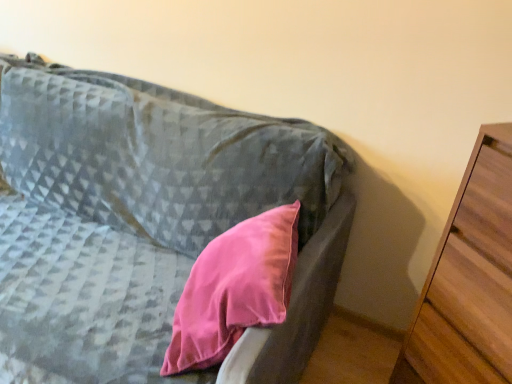
Locate an element on the screen. The height and width of the screenshot is (384, 512). wooden chest of drawers at right is located at coordinates (469, 280).

Describe the element at coordinates (469, 280) in the screenshot. This screenshot has height=384, width=512. I see `wooden chest of drawers at right` at that location.

Identify the location of matte gray couch at center. (145, 217).

The height and width of the screenshot is (384, 512). Describe the element at coordinates (145, 217) in the screenshot. I see `matte gray couch at center` at that location.

The width and height of the screenshot is (512, 384). I want to click on wooden chest of drawers at right, so click(x=469, y=280).

Can you confirm if matte gray couch at center is positioned to the right of wooden chest of drawers at right?

No, matte gray couch at center is not to the right of wooden chest of drawers at right.

Is the position of matte gray couch at center more distant than that of wooden chest of drawers at right?

No, it is not.

Which is behind, point (126, 350) or point (452, 233)?

The point (126, 350) is farther.

From the image's perspective, is matte gray couch at center above or below wooden chest of drawers at right?

matte gray couch at center is above wooden chest of drawers at right.

From a real-world perspective, who is located higher, matte gray couch at center or wooden chest of drawers at right?

From a 3D spatial view, wooden chest of drawers at right is above.

Looking at their sizes, would you say matte gray couch at center is wider or thinner than wooden chest of drawers at right?

matte gray couch at center is wider than wooden chest of drawers at right.

Can you confirm if matte gray couch at center is shorter than wooden chest of drawers at right?

Correct, matte gray couch at center is not as tall as wooden chest of drawers at right.

Who is smaller, matte gray couch at center or wooden chest of drawers at right?

wooden chest of drawers at right.

Is matte gray couch at center spatially inside wooden chest of drawers at right, or outside of it?

matte gray couch at center is not inside wooden chest of drawers at right, it's outside.

Consider the image. Is matte gray couch at center directly adjacent to wooden chest of drawers at right?

No, matte gray couch at center is not with wooden chest of drawers at right.

Could you tell me if matte gray couch at center is facing wooden chest of drawers at right?

No, matte gray couch at center is not turned towards wooden chest of drawers at right.

How different are the orientations of matte gray couch at center and wooden chest of drawers at right in degrees?

The angle between the facing direction of matte gray couch at center and the facing direction of wooden chest of drawers at right is 42.8 degrees.

How much distance is there between matte gray couch at center and wooden chest of drawers at right?

matte gray couch at center is 70.37 centimeters from wooden chest of drawers at right.

This screenshot has height=384, width=512. I want to click on chest of drawers on the right side of matte gray couch at center, so click(469, 280).

Is wooden chest of drawers at right to the left of matte gray couch at center from the viewer's perspective?

In fact, wooden chest of drawers at right is to the right of matte gray couch at center.

Is wooden chest of drawers at right further to camera compared to matte gray couch at center?

Yes, wooden chest of drawers at right is further from the camera.

Is point (471, 303) farther from camera compared to point (317, 226)?

No, it is in front of (317, 226).

In the scene shown: From the image's perspective, is wooden chest of drawers at right on matte gray couch at center?

Incorrect, from the image's perspective, wooden chest of drawers at right is lower than matte gray couch at center.

From a real-world perspective, is wooden chest of drawers at right on top of matte gray couch at center?

Yes, from a real-world perspective, wooden chest of drawers at right is on top of matte gray couch at center.

Can you confirm if wooden chest of drawers at right is thinner than matte gray couch at center?

Correct, the width of wooden chest of drawers at right is less than that of matte gray couch at center.

Between wooden chest of drawers at right and matte gray couch at center, which one has less height?

matte gray couch at center.

Considering the relative sizes of wooden chest of drawers at right and matte gray couch at center in the image provided, is wooden chest of drawers at right bigger than matte gray couch at center?

Actually, wooden chest of drawers at right might be smaller than matte gray couch at center.

Does wooden chest of drawers at right contain matte gray couch at center?

No, matte gray couch at center is not inside wooden chest of drawers at right.

In the scene shown: Is wooden chest of drawers at right far away from matte gray couch at center?

No, wooden chest of drawers at right is in close proximity to matte gray couch at center.

Is wooden chest of drawers at right looking in the opposite direction of matte gray couch at center?

No, matte gray couch at center is not at the back of wooden chest of drawers at right.

What's the angular difference between wooden chest of drawers at right and matte gray couch at center's facing directions?

They differ by 42.8 degrees in their facing directions.

The height and width of the screenshot is (384, 512). I want to click on the chest of drawers lying behind the matte gray couch at center, so click(x=469, y=280).

Locate an element on the screen. furniture that is in front of the wooden chest of drawers at right is located at coordinates [x=145, y=217].

You are a GUI agent. You are given a task and a screenshot of the screen. Output one action in this format:
    pyautogui.click(x=<x>, y=<y>)
    Task: Click on the furniture that appears below the wooden chest of drawers at right (from a real-world perspective)
    The width and height of the screenshot is (512, 384).
    Given the screenshot: What is the action you would take?
    pyautogui.click(x=145, y=217)